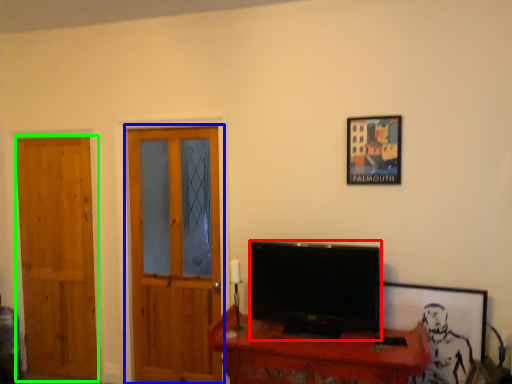
Question: Which object is the closest to the television (highlighted by a red box)? Choose among these: door (highlighted by a blue box) or door (highlighted by a green box).

Choices:
 (A) door
 (B) door

Answer: (A)